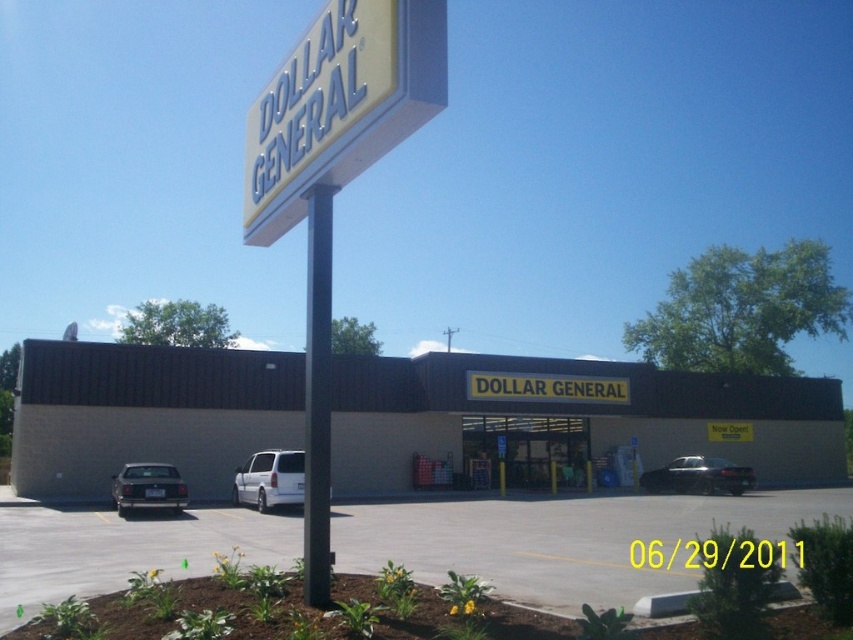
Question: Which is nearer to the beige concrete building at center?

Choices:
 (A) matte black sedan at lower left
 (B) satin black sedan at center
 (C) gray asphalt parking lot at center
 (D) black smooth pole at center

Answer: (B)

Question: Does beige concrete building at center have a smaller size compared to satin black sedan at center?

Choices:
 (A) no
 (B) yes

Answer: (A)

Question: Considering the real-world distances, which object is closest to the matte black sedan at lower left?

Choices:
 (A) gray asphalt parking lot at center
 (B) beige concrete building at center
 (C) yellow plastic sign at upper center

Answer: (A)

Question: Can you confirm if beige concrete building at center is smaller than gray asphalt parking lot at center?

Choices:
 (A) yes
 (B) no

Answer: (B)

Question: Can you confirm if beige concrete building at center is wider than yellow plastic sign at upper center?

Choices:
 (A) yes
 (B) no

Answer: (A)

Question: Which is nearer to the gray asphalt parking lot at center?

Choices:
 (A) beige concrete building at center
 (B) white matte van at center
 (C) matte black sedan at lower left
 (D) black smooth pole at center

Answer: (D)